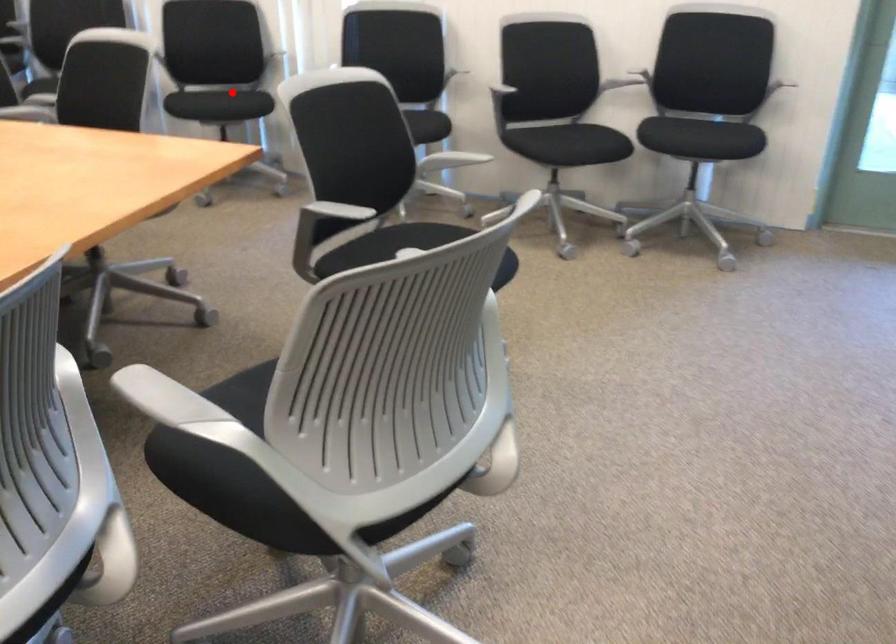
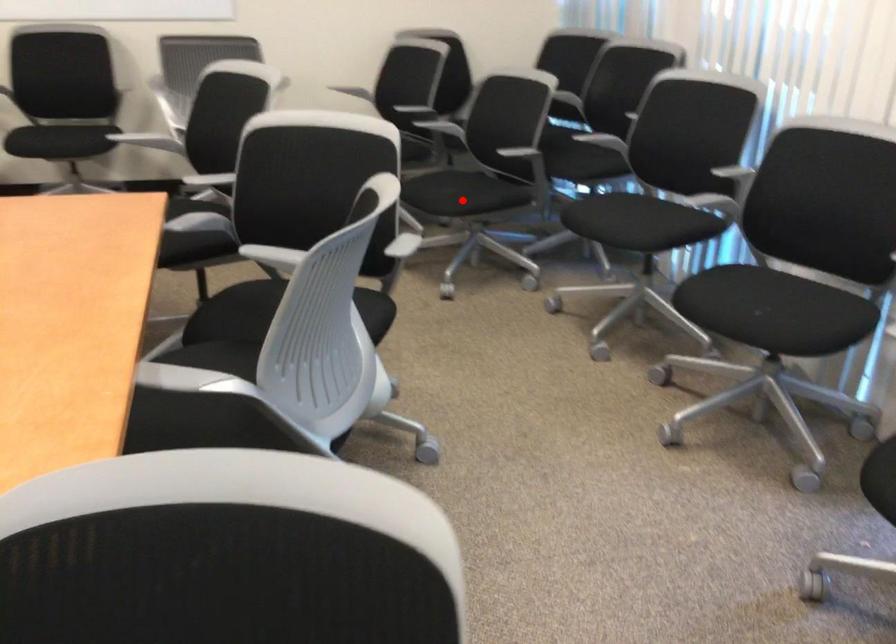
I am providing you with two images of the same scene from different viewpoints. A red point is marked on the first image and another point is marked on the second image. Are the points marked in image1 and image2 representing the same 3D position?

No